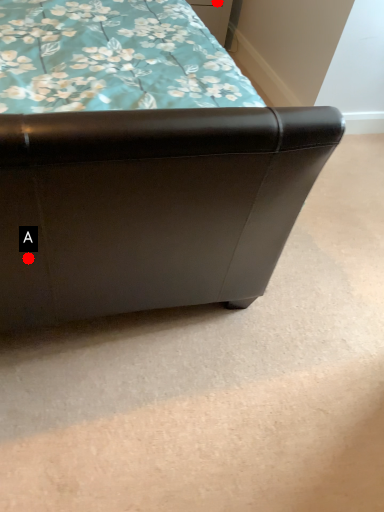
Question: Two points are circled on the image, labeled by A and B beside each circle. Which point appears farthest from the camera in this image?

Choices:
 (A) A is further
 (B) B is further

Answer: (B)